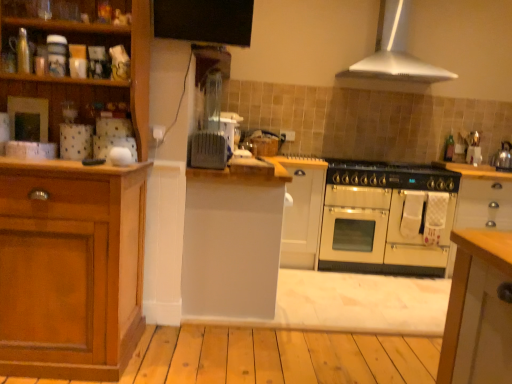
What do you see at coordinates (227, 126) in the screenshot? This screenshot has width=512, height=384. I see `satin silver toaster at center, the 2th appliance from the front` at bounding box center [227, 126].

In order to click on satin silver toaster at center, the 2th appliance from the front in this screenshot , I will do `click(227, 126)`.

Identify the location of white matte cabinet at center, the third cabinetry positioned from the left. [302, 212].

What do you see at coordinates (449, 148) in the screenshot? This screenshot has height=384, width=512. I see `green glass bottle at upper right` at bounding box center [449, 148].

Locate an element on the screen. This screenshot has height=384, width=512. cream matte oven at center is located at coordinates (387, 218).

Describe the element at coordinates (387, 218) in the screenshot. I see `cream matte oven at center` at that location.

The image size is (512, 384). What do you see at coordinates (74, 222) in the screenshot?
I see `wooden cabinet at left, the first cabinetry viewed from the left` at bounding box center [74, 222].

The image size is (512, 384). Find the location of `satin silver toaster at center, which is the first appliance from back to front`. satin silver toaster at center, which is the first appliance from back to front is located at coordinates (227, 126).

Which object is further away from the camera taking this photo, white matte cabinet at center, which is counted as the 3th cabinetry, starting from the right, or white matte cabinet at center, positioned as the 2th cabinetry in right-to-left order?

white matte cabinet at center, positioned as the 2th cabinetry in right-to-left order.

From a real-world perspective, is white matte cabinet at center, which is counted as the 3th cabinetry, starting from the right, positioned above or below white matte cabinet at center, positioned as the 2th cabinetry in right-to-left order?

white matte cabinet at center, which is counted as the 3th cabinetry, starting from the right, is situated higher than white matte cabinet at center, positioned as the 2th cabinetry in right-to-left order, in the real world.

Is white matte cabinet at center, positioned as the 2th cabinetry in right-to-left order, located within white matte cabinet at center, which is counted as the 3th cabinetry, starting from the right?

That's incorrect, white matte cabinet at center, positioned as the 2th cabinetry in right-to-left order, is not inside white matte cabinet at center, which is counted as the 3th cabinetry, starting from the right.

Where is `oven behind the satin silver toaster at center, the 2th appliance from the front`? The width and height of the screenshot is (512, 384). oven behind the satin silver toaster at center, the 2th appliance from the front is located at coordinates (387, 218).

From a real-world perspective, is cream matte oven at center located beneath satin silver toaster at center, which is the first appliance from back to front?

Correct, in the physical world, cream matte oven at center is lower than satin silver toaster at center, which is the first appliance from back to front.

Is cream matte oven at center positioned with its back to satin silver toaster at center, the 2th appliance from the front?

cream matte oven at center is not turned away from satin silver toaster at center, the 2th appliance from the front.

Based on the photo, is cream matte oven at center touching satin silver toaster at center, the 2th appliance from the front?

There is a gap between cream matte oven at center and satin silver toaster at center, the 2th appliance from the front.

From the image's perspective, is white matte cabinet at center, the second cabinetry positioned from the left, above or below matte black gas stove at center?

white matte cabinet at center, the second cabinetry positioned from the left, is below matte black gas stove at center.

From a real-world perspective, is white matte cabinet at center, the second cabinetry positioned from the left, located beneath matte black gas stove at center?

Correct, in the physical world, white matte cabinet at center, the second cabinetry positioned from the left, is lower than matte black gas stove at center.

Is white matte cabinet at center, which is counted as the 3th cabinetry, starting from the right, in contact with matte black gas stove at center?

No, white matte cabinet at center, which is counted as the 3th cabinetry, starting from the right, is not with matte black gas stove at center.

Is slate gray toaster at center, which appears as the 1th appliance when viewed from the front, bigger than white matte cabinet at center, the second cabinetry positioned from the left?

No, slate gray toaster at center, which appears as the 1th appliance when viewed from the front, is not bigger than white matte cabinet at center, the second cabinetry positioned from the left.

Is slate gray toaster at center, which appears as the 1th appliance when viewed from the front, not close to white matte cabinet at center, which is counted as the 3th cabinetry, starting from the right?

slate gray toaster at center, which appears as the 1th appliance when viewed from the front, is actually quite close to white matte cabinet at center, which is counted as the 3th cabinetry, starting from the right.

Which of these two, slate gray toaster at center, the 2th appliance from the back, or white matte cabinet at center, the second cabinetry positioned from the left, stands shorter?

slate gray toaster at center, the 2th appliance from the back, is shorter.

From the image's perspective, is slate gray toaster at center, which appears as the 1th appliance when viewed from the front, below white matte cabinet at center, which is counted as the 3th cabinetry, starting from the right?

Actually, slate gray toaster at center, which appears as the 1th appliance when viewed from the front, appears above white matte cabinet at center, which is counted as the 3th cabinetry, starting from the right, in the image.

Can you confirm if green glass bottle at upper right is wider than matte black gas stove at center?

No, green glass bottle at upper right is not wider than matte black gas stove at center.

From the image's perspective, between green glass bottle at upper right and matte black gas stove at center, which one is located above?

From the image's view, green glass bottle at upper right is above.

Considering the relative positions of green glass bottle at upper right and matte black gas stove at center in the image provided, is green glass bottle at upper right to the left or to the right of matte black gas stove at center?

green glass bottle at upper right is to the right of matte black gas stove at center.

Is cream matte oven at center further to the viewer compared to white glossy oven at center-right, which ranks as the 4th cabinetry in left-to-right order?

No, it is not.

Identify the location of cabinetry on the right side of cream matte oven at center. The width and height of the screenshot is (512, 384). tap(481, 196).

Considering the positions of points (333, 255) and (482, 207), is point (333, 255) closer to camera compared to point (482, 207)?

That is False.

Which of these two, cream matte oven at center or slate gray toaster at center, which appears as the 1th appliance when viewed from the front, stands taller?

With more height is cream matte oven at center.

Considering the sizes of objects cream matte oven at center and slate gray toaster at center, the 2th appliance from the back, in the image provided, who is wider, cream matte oven at center or slate gray toaster at center, the 2th appliance from the back,?

cream matte oven at center is wider.

Can you tell me how much cream matte oven at center and slate gray toaster at center, which appears as the 1th appliance when viewed from the front, differ in facing direction?

The angular difference between cream matte oven at center and slate gray toaster at center, which appears as the 1th appliance when viewed from the front, is 90.3 degrees.

The height and width of the screenshot is (384, 512). In order to click on the 1st cabinetry to the right when counting from the white matte cabinet at center, which is counted as the 3th cabinetry, starting from the right in this screenshot , I will do `click(302, 212)`.

Identify the location of the 2nd appliance positioned above the cream matte oven at center (from a real-world perspective). (227, 126).

Looking at the image, which one is located closer to matte black gas stove at center, satin silver toaster at center, the 2th appliance from the front, or white metallic range hood at upper center?

Based on the image, white metallic range hood at upper center appears to be nearer to matte black gas stove at center.

When comparing their distances from satin silver toaster at center, the 2th appliance from the front, does slate gray toaster at center, which appears as the 1th appliance when viewed from the front, or white metallic range hood at upper center seem further?

white metallic range hood at upper center is positioned further to the anchor satin silver toaster at center, the 2th appliance from the front.

Looking at the image, which one is located closer to metallic silver kettle at right, satin silver toaster at center, the 2th appliance from the front, or white matte cabinet at center, positioned as the 2th cabinetry in right-to-left order?

white matte cabinet at center, positioned as the 2th cabinetry in right-to-left order.

When comparing their distances from white metallic range hood at upper center, does metallic silver kettle at right or wooden cabinet at left, which is the 4th cabinetry from right to left, seem further?

wooden cabinet at left, which is the 4th cabinetry from right to left, lies further to white metallic range hood at upper center than the other object.

Based on their spatial positions, is white matte cabinet at center, which is counted as the 3th cabinetry, starting from the right, or green glass bottle at upper right closer to white matte cabinet at center, the third cabinetry positioned from the left?

Based on the image, white matte cabinet at center, which is counted as the 3th cabinetry, starting from the right, appears to be nearer to white matte cabinet at center, the third cabinetry positioned from the left.

When comparing their distances from white matte cabinet at center, the second cabinetry positioned from the left, does green glass bottle at upper right or satin silver toaster at center, the 2th appliance from the front, seem closer?

The object closer to white matte cabinet at center, the second cabinetry positioned from the left, is satin silver toaster at center, the 2th appliance from the front.

Based on their spatial positions, is metallic silver kettle at right or white matte cabinet at center, the second cabinetry positioned from the left, closer to wooden cabinet at left, which is the 4th cabinetry from right to left?

white matte cabinet at center, the second cabinetry positioned from the left.

From the picture: Which object lies nearer to the anchor point white matte cabinet at center, which is counted as the 3th cabinetry, starting from the right, metallic silver kettle at right or matte black gas stove at center?

matte black gas stove at center lies closer to white matte cabinet at center, which is counted as the 3th cabinetry, starting from the right, than the other object.

Where is `bottle between white metallic range hood at upper center and metallic silver kettle at right in the vertical direction`? This screenshot has height=384, width=512. bottle between white metallic range hood at upper center and metallic silver kettle at right in the vertical direction is located at coordinates (449, 148).

Locate an element on the screen. The image size is (512, 384). bottle between wooden cabinet at left, the first cabinetry viewed from the left, and metallic silver kettle at right is located at coordinates (449, 148).

The image size is (512, 384). Identify the location of home appliance between matte black gas stove at center and metallic silver kettle at right in the horizontal direction. (395, 56).

Locate an element on the screen. The width and height of the screenshot is (512, 384). home appliance between satin silver toaster at center, the 2th appliance from the front, and white glossy oven at center-right, which ranks as the 4th cabinetry in left-to-right order is located at coordinates (395, 56).